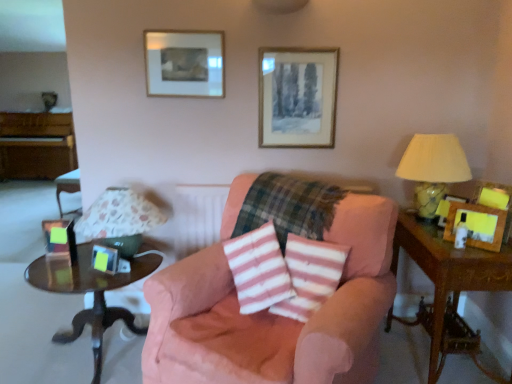
At what (x,y) coordinates should I click in order to perform the action: click on vacant region under wooden side table at right, marked as the 2th table in a left-to-right arrangement (from a real-world perspective). Please return your answer as a coordinate pair (x, y). Image resolution: width=512 pixels, height=384 pixels. Looking at the image, I should click on (446, 357).